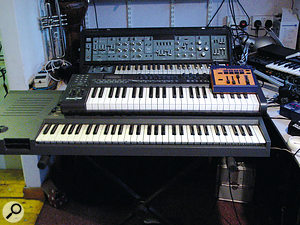
The image size is (300, 225). I want to click on socket, so click(x=263, y=20).